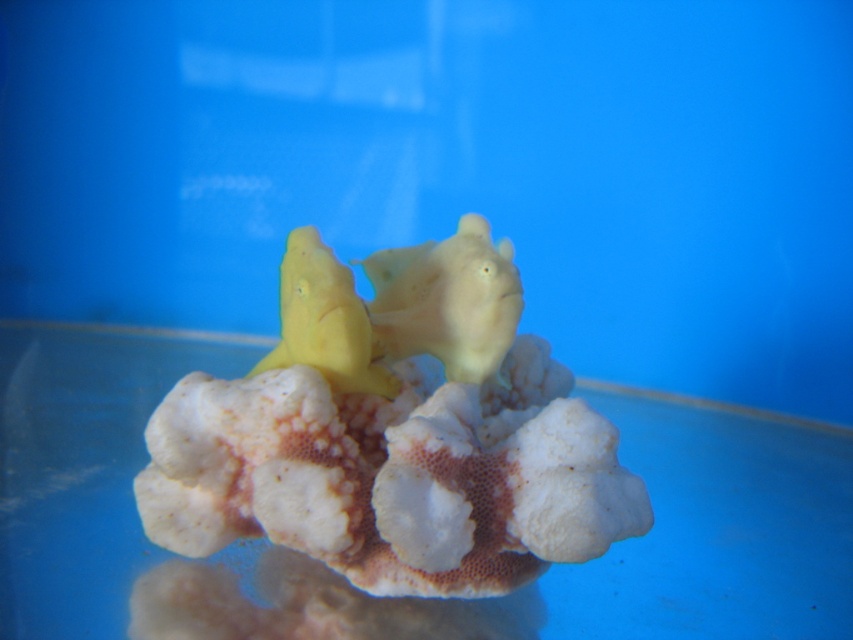
Question: Among these points, which one is farthest from the camera?

Choices:
 (A) (294, 348)
 (B) (492, 323)

Answer: (B)

Question: Is matte yellow fish at center below yellow matte fish at center?

Choices:
 (A) yes
 (B) no

Answer: (B)

Question: Which object is closer to the camera taking this photo?

Choices:
 (A) yellow matte fish at center
 (B) matte yellow fish at center

Answer: (A)

Question: Can you confirm if matte yellow fish at center is positioned to the left of yellow matte fish at center?

Choices:
 (A) no
 (B) yes

Answer: (A)

Question: Does matte yellow fish at center come in front of yellow matte fish at center?

Choices:
 (A) yes
 (B) no

Answer: (B)